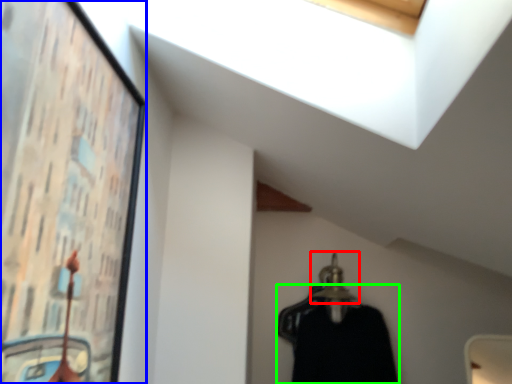
Question: Which object is positioned farthest from hanger (highlighted by a red box)? Select from picture frame (highlighted by a blue box) and clothing (highlighted by a green box).

Choices:
 (A) picture frame
 (B) clothing

Answer: (A)